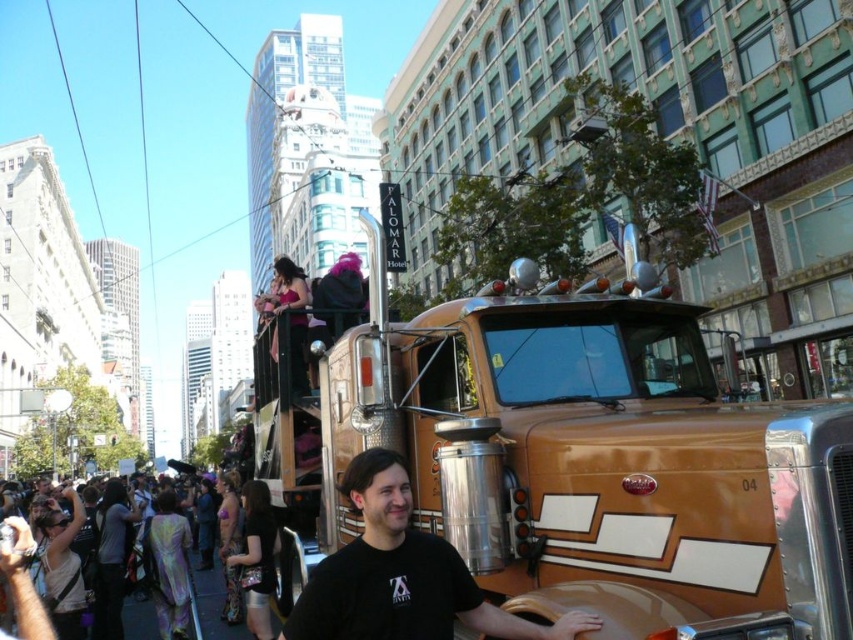
Question: Is gold metallic truck at center thinner than black matte shirt at center?

Choices:
 (A) no
 (B) yes

Answer: (A)

Question: Which object is the farthest from the holographic fabric crowd at lower left?

Choices:
 (A) black matte shirt at center
 (B) gold metallic truck at center

Answer: (A)

Question: Which object is the farthest from the holographic fabric crowd at lower left?

Choices:
 (A) black matte shirt at center
 (B) gold metallic truck at center

Answer: (A)

Question: Among these objects, which one is nearest to the camera?

Choices:
 (A) gold metallic truck at center
 (B) holographic fabric crowd at lower left

Answer: (A)

Question: Is gold metallic truck at center bigger than holographic fabric crowd at lower left?

Choices:
 (A) no
 (B) yes

Answer: (B)

Question: Is black matte shirt at center to the left of holographic fabric crowd at lower left from the viewer's perspective?

Choices:
 (A) no
 (B) yes

Answer: (A)